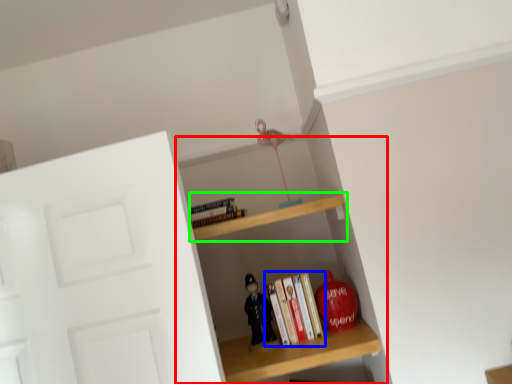
Question: Based on their relative distances, which object is farther from shelf (highlighted by a red box)? Choose from book (highlighted by a blue box) and shelf (highlighted by a green box).

Choices:
 (A) book
 (B) shelf

Answer: (B)